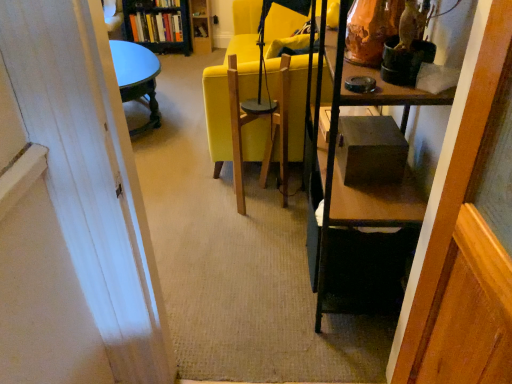
Question: Relative to wooden swivel chair at center, is hardcover books at upper left, which is the second book in top-to-bottom order, in front or behind?

Choices:
 (A) front
 (B) behind

Answer: (B)

Question: Do you think hardcover books at upper left, which is the second book in top-to-bottom order, is within wooden swivel chair at center, or outside of it?

Choices:
 (A) inside
 (B) outside

Answer: (B)

Question: Which is nearer to the wooden swivel chair at center?

Choices:
 (A) matte yellow chair at center
 (B) hardcover books at upper left, the first book when ordered from bottom to top
 (C) hardcover book at upper center, arranged as the second book when ordered from the bottom

Answer: (A)

Question: Which object is positioned closest to the wooden swivel chair at center?

Choices:
 (A) matte yellow chair at center
 (B) hardcover book at upper center, the 1th book from the top
 (C) hardcover books at upper left, which is the second book in top-to-bottom order

Answer: (A)